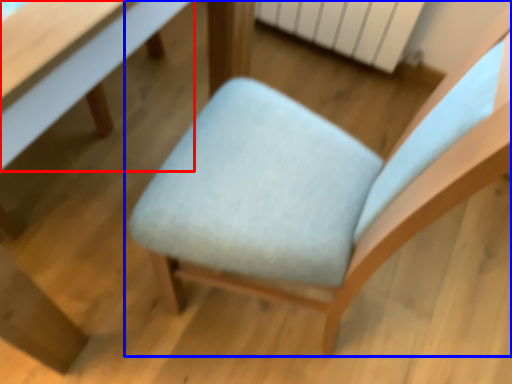
Question: Which point is closer to the camera, table (highlighted by a red box) or chair (highlighted by a blue box)?

Choices:
 (A) table
 (B) chair

Answer: (B)